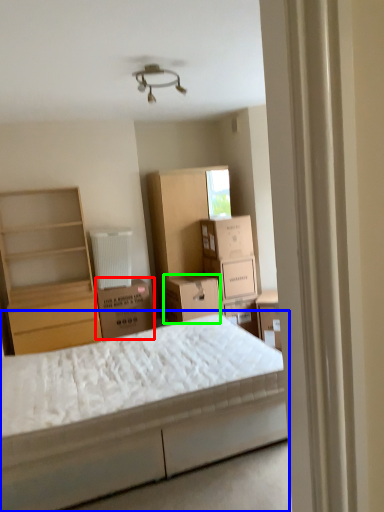
Question: Considering the real-world distances, which object is closest to cardboard box (highlighted by a red box)? bed (highlighted by a blue box) or storage box (highlighted by a green box).

Choices:
 (A) bed
 (B) storage box

Answer: (B)